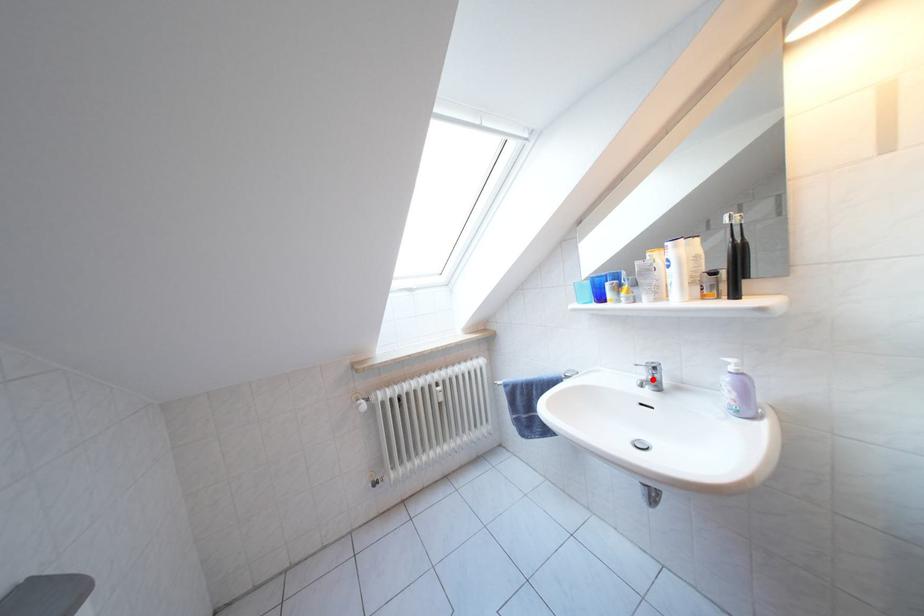
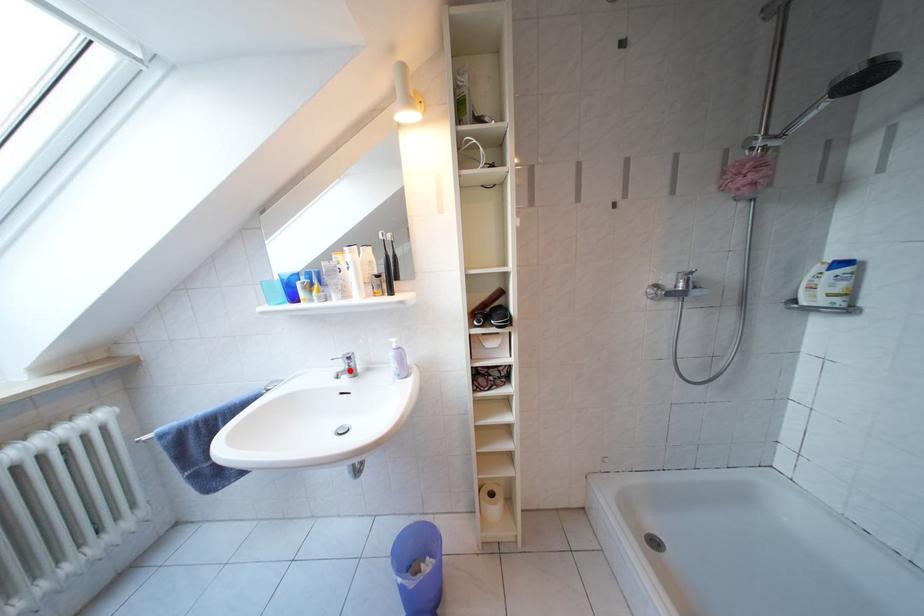
I am providing you with two images of the same scene from different viewpoints. A red point is marked on the first image and another point is marked on the second image. Is the red point in image1 aligned with the point shown in image2?

Yes